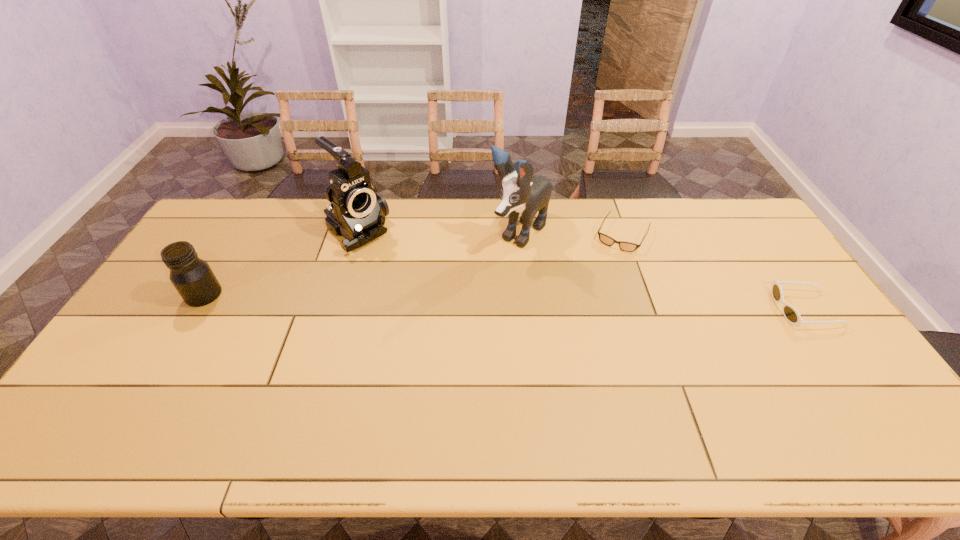
Where is `free region located on the right of the third tallest object`? free region located on the right of the third tallest object is located at coordinates (257, 295).

Identify the location of blank space located 0.110m with the lenses of the fourth tallest object facing outward. The image size is (960, 540). (739, 309).

At what (x,y) coordinates should I click in order to perform the action: click on vacant region located with the lenses of the fourth tallest object facing outward. Please return your answer as a coordinate pair (x, y). Looking at the image, I should click on (756, 309).

Where is `free space located with the lenses of the fourth tallest object facing outward`? The image size is (960, 540). free space located with the lenses of the fourth tallest object facing outward is located at coordinates (688, 309).

Image resolution: width=960 pixels, height=540 pixels. Identify the location of free spot located 0.260m on the front-facing side of the puppy. (455, 303).

The height and width of the screenshot is (540, 960). Find the location of `vacant region located 0.080m on the front-facing side of the puppy`. vacant region located 0.080m on the front-facing side of the puppy is located at coordinates (490, 269).

The width and height of the screenshot is (960, 540). I want to click on blank area located 0.150m on the front-facing side of the puppy, so click(476, 282).

Where is `vacant space located on the lens mount of the camcorder`? The height and width of the screenshot is (540, 960). vacant space located on the lens mount of the camcorder is located at coordinates (433, 299).

Where is `free space located 0.140m on the lens mount of the camcorder`? This screenshot has height=540, width=960. free space located 0.140m on the lens mount of the camcorder is located at coordinates (400, 272).

You are a GUI agent. You are given a task and a screenshot of the screen. Output one action in this format:
    pyautogui.click(x=<x>, y=<y>)
    Task: Click on the free location located 0.310m on the lens mount of the camcorder
    The width and height of the screenshot is (960, 540).
    Given the screenshot: What is the action you would take?
    pyautogui.click(x=435, y=300)